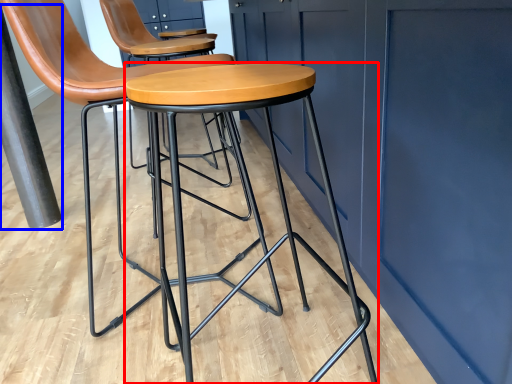
Question: Which object is closer to the camera taking this photo, stool (highlighted by a red box) or pole (highlighted by a blue box)?

Choices:
 (A) stool
 (B) pole

Answer: (A)